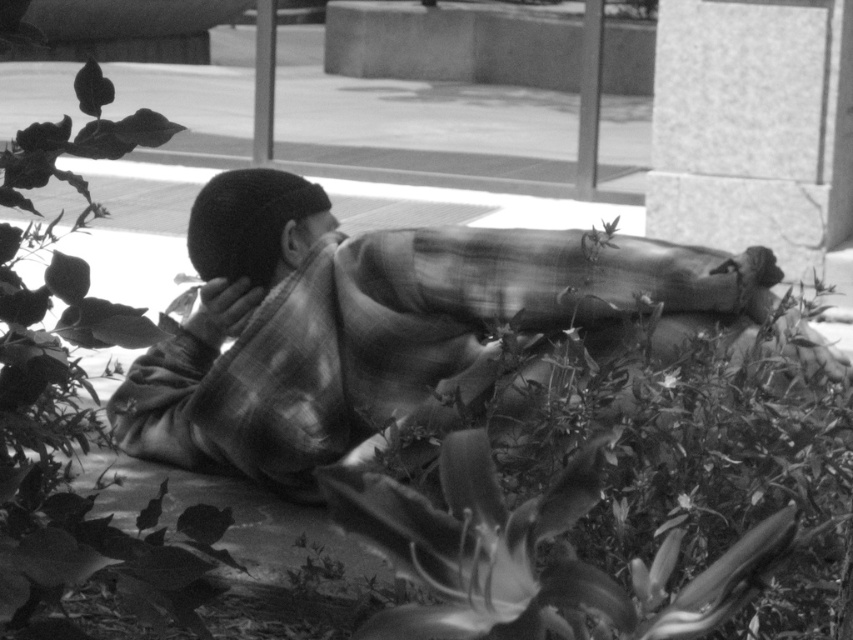
You are a photographer who wants to capture a closeup of the smooth skin face at center without including the plaid fabric at center in the frame. Given their relative sizes, is this possible?

The plaid fabric at center is wider than the smooth skin face at center, so it is possible to frame the shot to exclude the plaid fabric at center while focusing on the smooth skin face at center.

You are a photographer who wants to capture a closeup of the green leafy plant at center and the smooth skin face at center in the image. Which object should you zoom in on to ensure both are in focus without moving the camera?

Since the green leafy plant at center is larger than the smooth skin face at center, you should zoom in on the green leafy plant at center to ensure both are in focus without moving the camera.